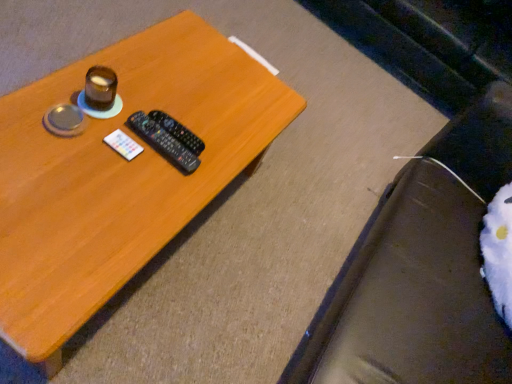
Image resolution: width=512 pixels, height=384 pixels. Identify the location of unoccupied space behind shiny brown cup at upper left. (135, 83).